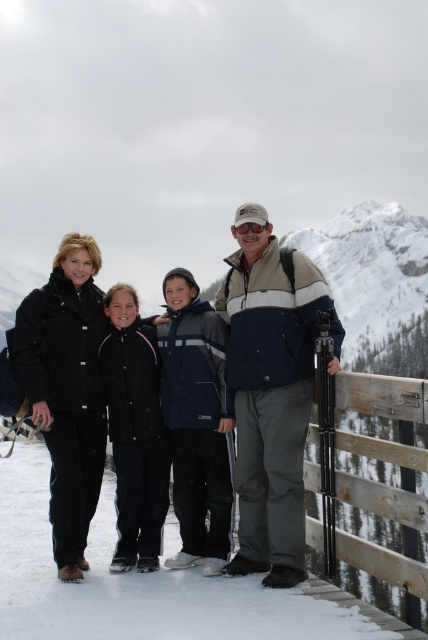
Question: Which object is positioned closest to the matte blue jacket at center?

Choices:
 (A) dark blue jacket at center
 (B) navy blue jacket at center
 (C) black matte jacket at center

Answer: (A)

Question: Is matte blue jacket at center above navy blue jacket at center?

Choices:
 (A) yes
 (B) no

Answer: (A)

Question: Can you confirm if navy blue jacket at center is positioned to the left of black matte jacket at center?

Choices:
 (A) no
 (B) yes

Answer: (A)

Question: Which point is closer to the camera?

Choices:
 (A) matte blue jacket at center
 (B) black matte jacket at center
 (C) navy blue jacket at center

Answer: (A)

Question: Can you confirm if dark blue jacket at center is smaller than black matte jacket at center?

Choices:
 (A) yes
 (B) no

Answer: (B)

Question: Estimate the real-world distances between objects in this image. Which object is closer to the black matte jacket at center?

Choices:
 (A) navy blue jacket at center
 (B) dark blue jacket at center
 (C) matte blue jacket at center

Answer: (A)